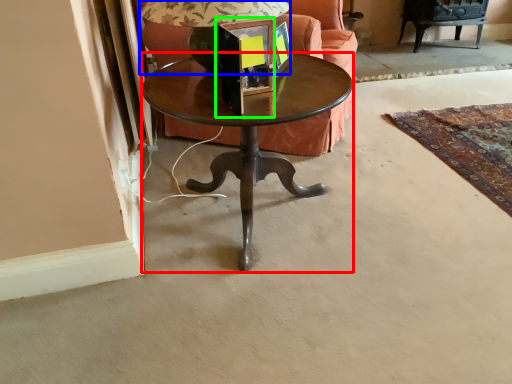
Question: Considering the real-world distances, which object is farthest from coffee table (highlighted by a red box)? table lamp (highlighted by a blue box) or picture frame (highlighted by a green box)?

Choices:
 (A) table lamp
 (B) picture frame

Answer: (A)